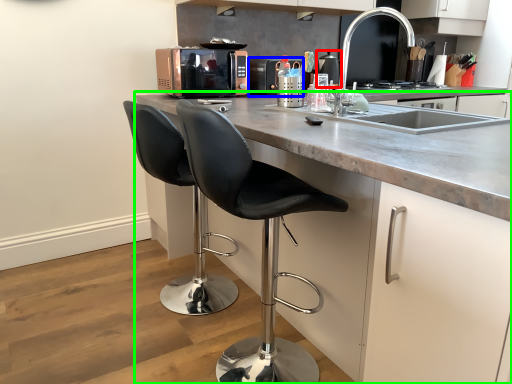
Question: Which object is the closest to the appliance (highlighted by a red box)? Choose among these: kitchen appliance (highlighted by a blue box) or cabinetry (highlighted by a green box).

Choices:
 (A) kitchen appliance
 (B) cabinetry

Answer: (A)